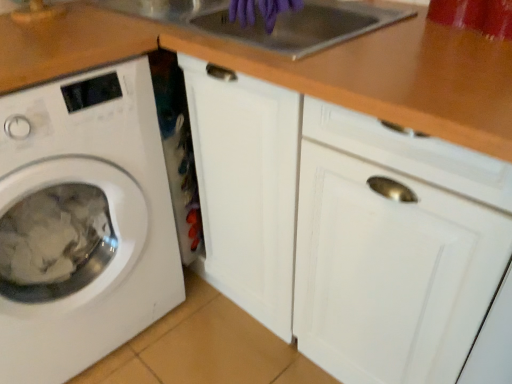
Image resolution: width=512 pixels, height=384 pixels. What do you see at coordinates (82, 222) in the screenshot?
I see `white matte washing machine at left` at bounding box center [82, 222].

Image resolution: width=512 pixels, height=384 pixels. I want to click on white matte washing machine at left, so click(82, 222).

This screenshot has width=512, height=384. What do you see at coordinates (276, 10) in the screenshot?
I see `purple rubber gloves at upper center` at bounding box center [276, 10].

In order to click on white matte washing machine at left in this screenshot , I will do `click(82, 222)`.

From the picture: How many degrees apart are the facing directions of white matte washing machine at left and wooden at upper center?

The angle between the facing direction of white matte washing machine at left and the facing direction of wooden at upper center is 88.6 degrees.

Between point (25, 382) and point (349, 68), which one is positioned behind?

The point (25, 382) is farther from the camera.

In terms of width, does white matte washing machine at left look wider or thinner when compared to wooden at upper center?

In the image, white matte washing machine at left appears to be wider than wooden at upper center.

Is the position of white matte washing machine at left more distant than that of wooden at upper center?

No.

Which of these two, wooden at upper center or purple rubber gloves at upper center, is smaller?

purple rubber gloves at upper center is smaller.

Considering the points (370, 58) and (249, 21), which point is behind, point (370, 58) or point (249, 21)?

Point (249, 21)

Does wooden at upper center have a lesser height compared to purple rubber gloves at upper center?

Correct, wooden at upper center is not as tall as purple rubber gloves at upper center.

From a real-world perspective, is wooden at upper center below white matte washing machine at left?

No, from a real-world perspective, wooden at upper center is not under white matte washing machine at left.

Is wooden at upper center closer to camera compared to white matte washing machine at left?

That is False.

Considering the positions of objects wooden at upper center and white matte washing machine at left in the image provided, who is more to the right, wooden at upper center or white matte washing machine at left?

From the viewer's perspective, wooden at upper center appears more on the right side.

Based on the photo, is wooden at upper center smaller than white matte washing machine at left?

Yes.

Can you confirm if purple rubber gloves at upper center is taller than wooden at upper center?

Yes, purple rubber gloves at upper center is taller than wooden at upper center.

From the image's perspective, is purple rubber gloves at upper center located above wooden at upper center?

Yes, from the image's perspective, purple rubber gloves at upper center is above wooden at upper center.

Does purple rubber gloves at upper center have a greater width compared to wooden at upper center?

No.

Does purple rubber gloves at upper center have a lesser width compared to white matte washing machine at left?

Correct, the width of purple rubber gloves at upper center is less than that of white matte washing machine at left.

Is purple rubber gloves at upper center to the right of white matte washing machine at left from the viewer's perspective?

Correct, you'll find purple rubber gloves at upper center to the right of white matte washing machine at left.

From the image's perspective, which object appears higher, purple rubber gloves at upper center or white matte washing machine at left?

From the image's view, purple rubber gloves at upper center is above.

Considering their positions, is purple rubber gloves at upper center located in front of or behind white matte washing machine at left?

purple rubber gloves at upper center is behind white matte washing machine at left.

You are a GUI agent. You are given a task and a screenshot of the screen. Output one action in this format:
    pyautogui.click(x=<x>, y=<y>)
    Task: Click on the washing machine below the purple rubber gloves at upper center (from the image's perspective)
    This screenshot has height=384, width=512.
    Given the screenshot: What is the action you would take?
    pyautogui.click(x=82, y=222)

From a real-world perspective, is white matte washing machine at left physically below purple rubber gloves at upper center?

Yes, from a real-world perspective, white matte washing machine at left is under purple rubber gloves at upper center.

What's the angular difference between white matte washing machine at left and purple rubber gloves at upper center's facing directions?

The facing directions of white matte washing machine at left and purple rubber gloves at upper center are 90.3 degrees apart.

Where is `counter top behind the white matte washing machine at left`? The image size is (512, 384). counter top behind the white matte washing machine at left is located at coordinates (303, 68).

Find the location of a particular element. The image size is (512, 384). counter top on the left of purple rubber gloves at upper center is located at coordinates (303, 68).

Considering their positions, is wooden at upper center positioned further to white matte washing machine at left than purple rubber gloves at upper center?

purple rubber gloves at upper center is further to white matte washing machine at left.

Considering their positions, is white matte washing machine at left positioned further to purple rubber gloves at upper center than wooden at upper center?

white matte washing machine at left is positioned further to the anchor purple rubber gloves at upper center.

Estimate the real-world distances between objects in this image. Which object is closer to wooden at upper center, purple rubber gloves at upper center or white matte washing machine at left?

purple rubber gloves at upper center lies closer to wooden at upper center than the other object.

Looking at the image, which one is located closer to wooden at upper center, white matte washing machine at left or purple rubber gloves at upper center?

purple rubber gloves at upper center.

Which object lies nearer to the anchor point purple rubber gloves at upper center, wooden at upper center or white matte washing machine at left?

wooden at upper center.

When comparing their distances from white matte washing machine at left, does purple rubber gloves at upper center or wooden at upper center seem closer?

wooden at upper center is closer to white matte washing machine at left.

Image resolution: width=512 pixels, height=384 pixels. Find the location of `counter top situated between white matte washing machine at left and purple rubber gloves at upper center from left to right`. counter top situated between white matte washing machine at left and purple rubber gloves at upper center from left to right is located at coordinates (303, 68).